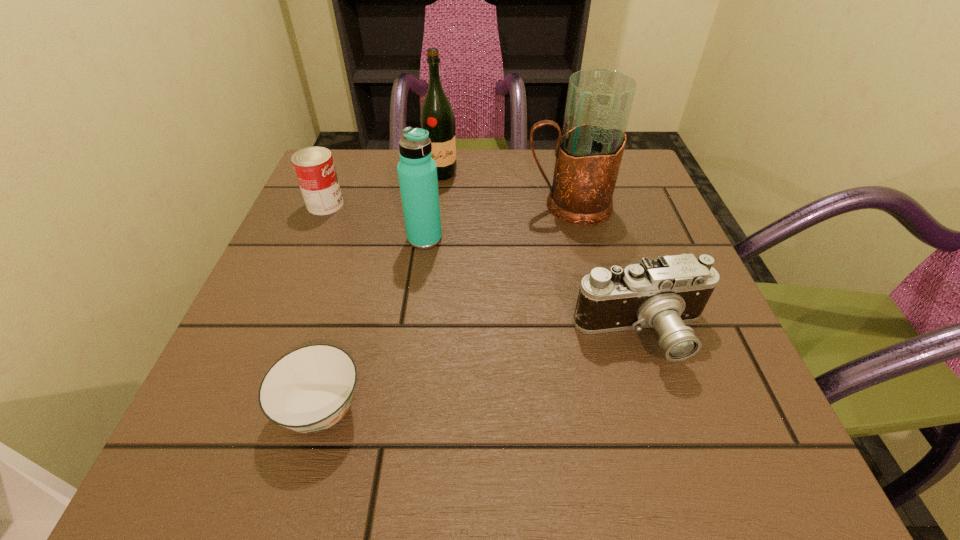
Locate an element on the screen. This screenshot has width=960, height=540. blank area at the right edge is located at coordinates (641, 337).

In the image, there is a desktop. Identify the location of free space at the far left corner. [344, 159].

Where is `vacant area at the near right corner`? This screenshot has width=960, height=540. vacant area at the near right corner is located at coordinates (742, 451).

Locate an element on the screen. free space that is in between the can and the liquor is located at coordinates (383, 189).

This screenshot has width=960, height=540. What are the coordinates of `free spot between the water bottle and the pitcher` in the screenshot? It's located at (496, 222).

Locate an element on the screen. free space between the camera and the third nearest object is located at coordinates (534, 286).

The height and width of the screenshot is (540, 960). Identify the location of vacant space in between the water bottle and the leftmost object. click(375, 221).

Find the location of a particular element. This screenshot has width=960, height=540. free space between the pitcher and the liquor is located at coordinates (505, 190).

You are a GUI agent. You are given a task and a screenshot of the screen. Output one action in this format:
    pyautogui.click(x=<x>, y=<y>)
    Task: Click on the unoccupied position between the fourth shortest object and the camera
    This screenshot has width=960, height=540.
    Given the screenshot: What is the action you would take?
    pyautogui.click(x=534, y=286)

Locate an element on the screen. This screenshot has width=960, height=540. vacant space that is in between the can and the camera is located at coordinates point(484,269).